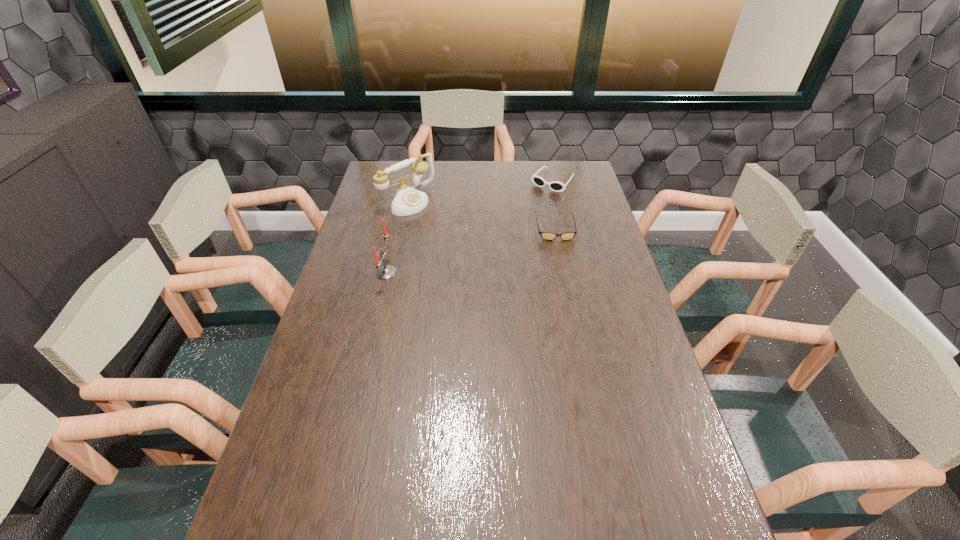
Find the location of a particular element. The height and width of the screenshot is (540, 960). object at the far right corner is located at coordinates (556, 186).

I want to click on free space at the far edge of the desktop, so click(x=504, y=170).

Where is `vacant area at the near edge`? This screenshot has height=540, width=960. vacant area at the near edge is located at coordinates (508, 509).

Find the location of a particular element. This screenshot has width=960, height=540. free spot at the left edge of the desktop is located at coordinates (389, 219).

Image resolution: width=960 pixels, height=540 pixels. In order to click on vacant area at the right edge of the desktop in this screenshot , I will do `click(560, 203)`.

You are a GUI agent. You are given a task and a screenshot of the screen. Output one action in this format:
    pyautogui.click(x=<x>, y=<y>)
    Task: Click on the free spot at the far left corner of the desktop
    This screenshot has height=540, width=960.
    Given the screenshot: What is the action you would take?
    pyautogui.click(x=407, y=173)

In the image, there is a desktop. At what (x,y) coordinates should I click in order to perform the action: click on vacant space at the far right corner. Please return your answer as a coordinate pair (x, y). This screenshot has width=960, height=540. Looking at the image, I should click on (589, 176).

Find the location of `free space between the telephone and the candle`. free space between the telephone and the candle is located at coordinates (397, 237).

Where is `free space that is in between the telephone and the nearest object`? The height and width of the screenshot is (540, 960). free space that is in between the telephone and the nearest object is located at coordinates (397, 237).

You are a GUI agent. You are given a task and a screenshot of the screen. Output one action in this format:
    pyautogui.click(x=<x>, y=<y>)
    Task: Click on the free point between the telephone and the third tallest object
    This screenshot has width=960, height=540.
    Given the screenshot: What is the action you would take?
    pyautogui.click(x=480, y=191)